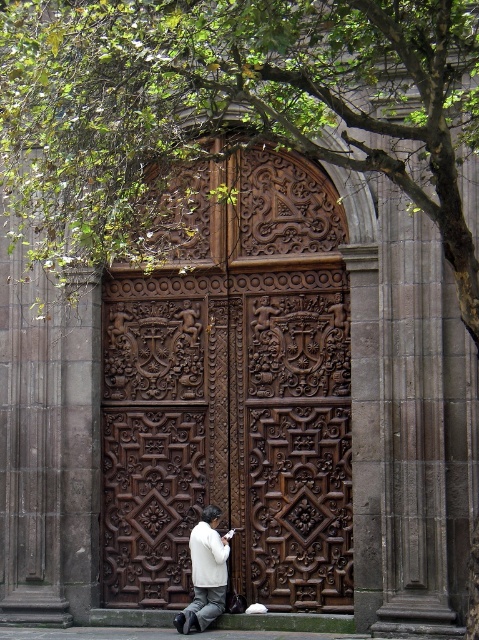
You are a painter standing in front of the scene. You need to paint the dark brown wood at center and the white matte jacket at lower center. Which object should you paint first if you want to follow the rule of painting from the tallest to the shortest objects?

The dark brown wood at center is much taller than the white matte jacket at lower center, so you should paint the dark brown wood at center first.

You are standing in front of the wooden door and need to place two markers at the specified coordinates. Which of the two points, point 1 at (235, 548) or point 2 at (205, 536), is located behind the other?

Point 1 at (235, 548) is behind point 2 at (205, 536).